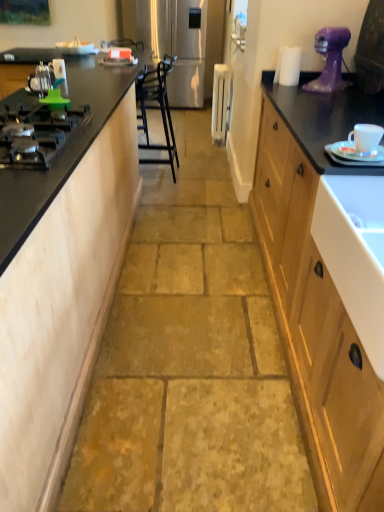
Question: Considering their positions, is matte wood cabinet at left located in front of or behind metallic silver kettle at left, positioned as the second appliance in front-to-back order?

Choices:
 (A) front
 (B) behind

Answer: (A)

Question: Is matte wood cabinet at left to the left or to the right of metallic silver kettle at left, which is counted as the 3th appliance, starting from the top, in the image?

Choices:
 (A) left
 (B) right

Answer: (B)

Question: Considering the real-world distances, which object is farthest from the metallic silver kettle at left, which is counted as the 3th appliance, starting from the top?

Choices:
 (A) white glossy sink at right
 (B) matte wood cabinet at left
 (C) stainless steel refrigerator at center, acting as the fourth appliance starting from the front
 (D) white glossy saucer at right
 (E) black matte gas stove at left

Answer: (C)

Question: Which of these objects is positioned closest to the white glossy juicer at upper center?

Choices:
 (A) metallic silver kettle at left, which is counted as the second appliance, starting from the bottom
 (B) black matte gas stove at left
 (C) white plastic radiator at center, which appears as the third appliance when ordered from the bottom
 (D) white glossy saucer at right
 (E) white ceramic cup at right, acting as the fourth appliance starting from the top

Answer: (C)